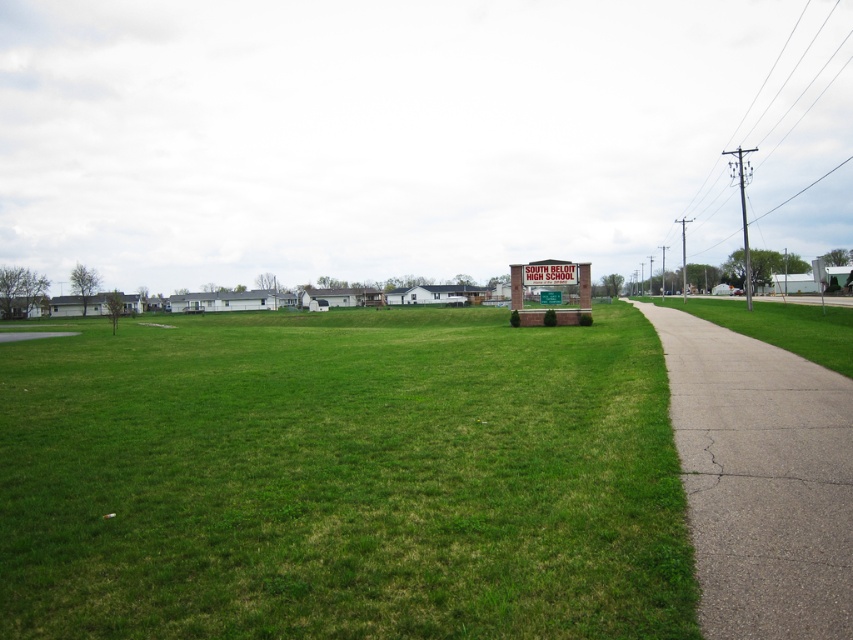
You are a student carrying a large poster that is 1.5 meters wide. You need to walk from the green grassy field at center to the green painted metal sign at center. Is there enough space between them for you to walk comfortably while holding the poster?

The distance between the green grassy field at center and the green painted metal sign at center is 13.45 meters. Since the poster is only 1.5 meters wide, there is ample space for you to walk comfortably between them.